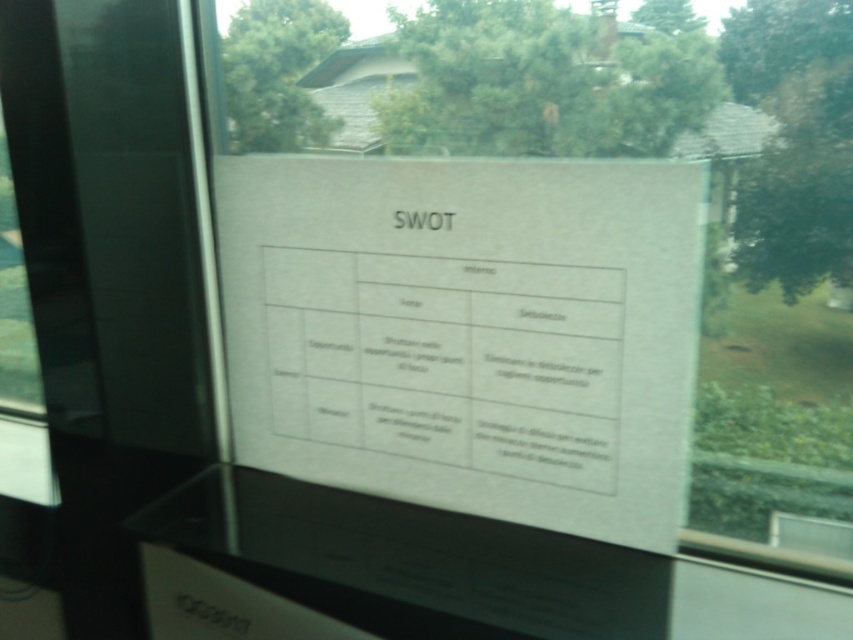
You are holding a ruler that is 2 feet long. You want to measure the distance between yourself and the transparent glass window at center. Can your ruler reach the window?

The transparent glass window at center is 6.70 feet away from the viewer. Since the ruler is only 2 feet long, it cannot reach the window.

Consider the image. You are an office worker trying to read the white paper at upper center. However, there is a transparent glass window at center in the way. Can you move the paper to the left to avoid the glare from the window?

The transparent glass window at center is positioned on the right side of white paper at upper center, so moving the paper to the left would place it away from the window, reducing glare and improving readability.

You are standing 1.5 meters away from the glass surface where the SWOT analysis paper is displayed. You want to touch the point at coordinates point (299, 291) on the paper. Can you reach it without moving your position?

The distance of point (299, 291) from viewer is 1.04 meters, so yes, you can reach it without moving since you are 1.5 meters away, which is farther than the point.